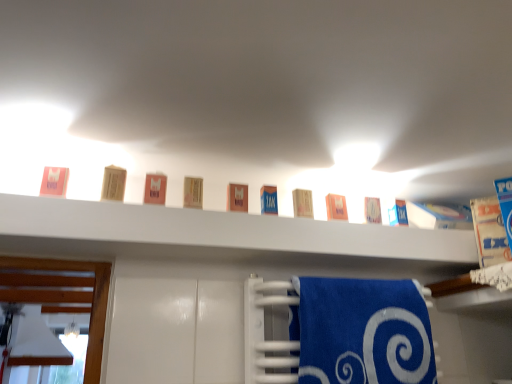
Question: Are blue terry cloth towel at lower center and white matte shelf at upper center beside each other?

Choices:
 (A) yes
 (B) no

Answer: (B)

Question: Considering the relative positions of blue terry cloth towel at lower center and white matte shelf at upper center in the image provided, is blue terry cloth towel at lower center to the right of white matte shelf at upper center from the viewer's perspective?

Choices:
 (A) yes
 (B) no

Answer: (A)

Question: Would you consider blue terry cloth towel at lower center to be distant from white matte shelf at upper center?

Choices:
 (A) no
 (B) yes

Answer: (A)

Question: Considering the relative sizes of blue terry cloth towel at lower center and white matte shelf at upper center in the image provided, is blue terry cloth towel at lower center wider than white matte shelf at upper center?

Choices:
 (A) no
 (B) yes

Answer: (A)

Question: Considering the relative sizes of blue terry cloth towel at lower center and white matte shelf at upper center in the image provided, is blue terry cloth towel at lower center taller than white matte shelf at upper center?

Choices:
 (A) yes
 (B) no

Answer: (A)

Question: Considering the relative sizes of blue terry cloth towel at lower center and white matte shelf at upper center in the image provided, is blue terry cloth towel at lower center shorter than white matte shelf at upper center?

Choices:
 (A) no
 (B) yes

Answer: (A)

Question: From the image's perspective, does white matte shelf at upper center appear higher than blue terry cloth towel at lower center?

Choices:
 (A) no
 (B) yes

Answer: (B)

Question: Does white matte shelf at upper center appear on the right side of blue terry cloth towel at lower center?

Choices:
 (A) yes
 (B) no

Answer: (B)

Question: From the image's perspective, is white matte shelf at upper center below blue terry cloth towel at lower center?

Choices:
 (A) no
 (B) yes

Answer: (A)

Question: Is blue terry cloth towel at lower center surrounded by white matte shelf at upper center?

Choices:
 (A) yes
 (B) no

Answer: (B)

Question: Considering the relative sizes of white matte shelf at upper center and blue terry cloth towel at lower center in the image provided, is white matte shelf at upper center thinner than blue terry cloth towel at lower center?

Choices:
 (A) no
 (B) yes

Answer: (A)

Question: Is white matte shelf at upper center taller than blue terry cloth towel at lower center?

Choices:
 (A) yes
 (B) no

Answer: (B)

Question: Relative to white matte shelf at upper center, is blue terry cloth towel at lower center in front or behind?

Choices:
 (A) front
 (B) behind

Answer: (B)